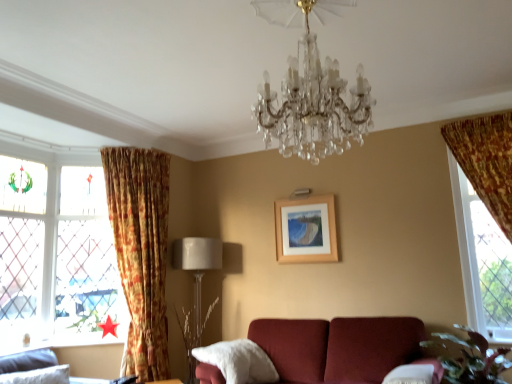
Question: Are clear crystal chandelier at center and stained glass window at left, positioned as the first window in back-to-front order, beside each other?

Choices:
 (A) no
 (B) yes

Answer: (A)

Question: From the image's perspective, is clear crystal chandelier at center located above stained glass window at left, which is counted as the second window, starting from the front?

Choices:
 (A) no
 (B) yes

Answer: (B)

Question: Is clear crystal chandelier at center in front of stained glass window at left, which is counted as the second window, starting from the front?

Choices:
 (A) yes
 (B) no

Answer: (A)

Question: Considering the relative sizes of clear crystal chandelier at center and stained glass window at left, positioned as the first window in back-to-front order, in the image provided, is clear crystal chandelier at center thinner than stained glass window at left, positioned as the first window in back-to-front order,?

Choices:
 (A) no
 (B) yes

Answer: (A)

Question: From a real-world perspective, is clear crystal chandelier at center below stained glass window at left, positioned as the first window in back-to-front order?

Choices:
 (A) no
 (B) yes

Answer: (A)

Question: Visually, is velvet gray sofa at lower left positioned to the left or to the right of stained glass window at left, which is the 2th window from right to left?

Choices:
 (A) left
 (B) right

Answer: (B)

Question: Considering the positions of velvet gray sofa at lower left and stained glass window at left, which is counted as the second window, starting from the front, in the image, is velvet gray sofa at lower left bigger or smaller than stained glass window at left, which is counted as the second window, starting from the front,?

Choices:
 (A) small
 (B) big

Answer: (A)

Question: Would you say velvet gray sofa at lower left is inside or outside stained glass window at left, which is counted as the first window, starting from the left?

Choices:
 (A) inside
 (B) outside

Answer: (B)

Question: In terms of width, does velvet gray sofa at lower left look wider or thinner when compared to stained glass window at left, which is the 2th window from right to left?

Choices:
 (A) wide
 (B) thin

Answer: (A)

Question: Looking at their shapes, would you say wooden frame at center is wider or thinner than stained glass window at left, which is the 2th window from right to left?

Choices:
 (A) wide
 (B) thin

Answer: (B)

Question: From a real-world perspective, is wooden frame at center above or below stained glass window at left, which is counted as the first window, starting from the left?

Choices:
 (A) below
 (B) above

Answer: (B)

Question: Visually, is wooden frame at center positioned to the left or to the right of stained glass window at left, which is the 2th window from right to left?

Choices:
 (A) right
 (B) left

Answer: (A)

Question: Does point (321, 248) appear closer or farther from the camera than point (93, 203)?

Choices:
 (A) farther
 (B) closer

Answer: (B)

Question: Do you think velvet gray sofa at lower left is within beige fabric lampshade at lower left, or outside of it?

Choices:
 (A) outside
 (B) inside

Answer: (A)

Question: Is velvet gray sofa at lower left bigger or smaller than beige fabric lampshade at lower left?

Choices:
 (A) big
 (B) small

Answer: (B)